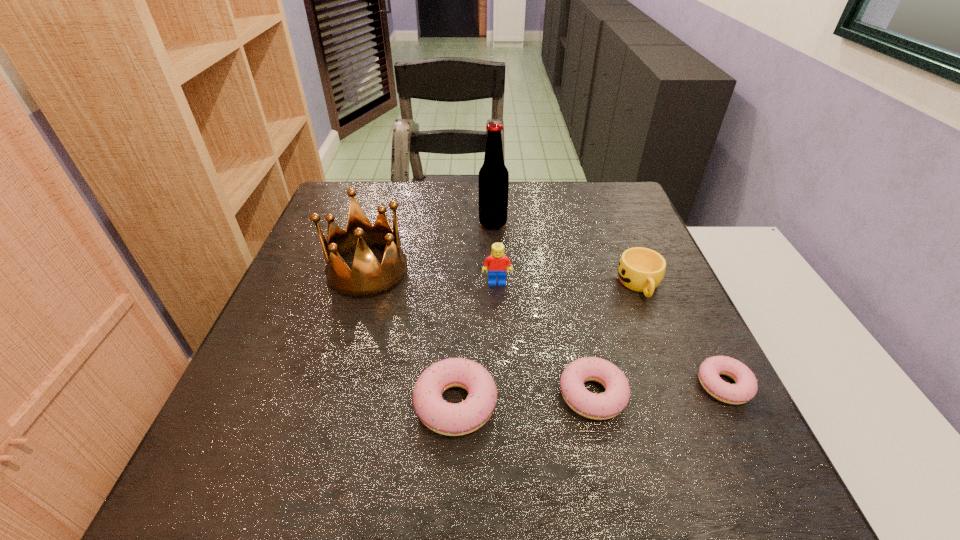
This screenshot has width=960, height=540. I want to click on the leftmost doughnut, so click(x=450, y=419).

Find the location of a particular element. Image resolution: width=960 pixels, height=540 pixels. the second doughnut from right to left is located at coordinates (613, 401).

This screenshot has height=540, width=960. I want to click on the fifth object from left to right, so click(x=613, y=401).

Find the location of `the shortest object`. the shortest object is located at coordinates (746, 387).

Where is `the rightmost doughnut`? the rightmost doughnut is located at coordinates (746, 387).

Where is `beer bottle`? beer bottle is located at coordinates (493, 176).

Image resolution: width=960 pixels, height=540 pixels. Find the location of `the tallest object`. the tallest object is located at coordinates (493, 176).

Where is `the leftmost object`? Image resolution: width=960 pixels, height=540 pixels. the leftmost object is located at coordinates (368, 278).

This screenshot has height=540, width=960. I want to click on the sixth shortest object, so click(368, 278).

What are the coordinates of `cup` in the screenshot? It's located at (640, 269).